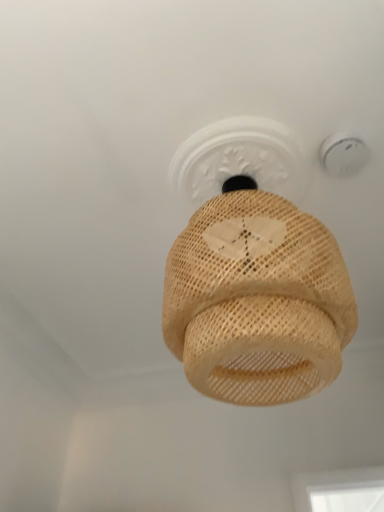
Question: From a real-world perspective, is natural woven lampshade at center under white plastic smoke detector at upper right?

Choices:
 (A) yes
 (B) no

Answer: (A)

Question: Does natural woven lampshade at center have a greater height compared to white plastic smoke detector at upper right?

Choices:
 (A) yes
 (B) no

Answer: (A)

Question: Is there a large distance between natural woven lampshade at center and white plastic smoke detector at upper right?

Choices:
 (A) no
 (B) yes

Answer: (A)

Question: Is natural woven lampshade at center at the right side of white plastic smoke detector at upper right?

Choices:
 (A) no
 (B) yes

Answer: (A)

Question: Can you confirm if natural woven lampshade at center is smaller than white plastic smoke detector at upper right?

Choices:
 (A) no
 (B) yes

Answer: (A)

Question: Is natural woven lampshade at center looking in the opposite direction of white plastic smoke detector at upper right?

Choices:
 (A) no
 (B) yes

Answer: (A)

Question: Considering the relative sizes of white plastic smoke detector at upper right and natural woven lampshade at center in the image provided, is white plastic smoke detector at upper right smaller than natural woven lampshade at center?

Choices:
 (A) no
 (B) yes

Answer: (B)

Question: Would you say white plastic smoke detector at upper right contains natural woven lampshade at center?

Choices:
 (A) no
 (B) yes

Answer: (A)

Question: Could you tell me if white plastic smoke detector at upper right is facing natural woven lampshade at center?

Choices:
 (A) yes
 (B) no

Answer: (B)

Question: From a real-world perspective, is white plastic smoke detector at upper right positioned over natural woven lampshade at center based on gravity?

Choices:
 (A) no
 (B) yes

Answer: (B)

Question: Does white plastic smoke detector at upper right have a lesser width compared to natural woven lampshade at center?

Choices:
 (A) no
 (B) yes

Answer: (B)

Question: Considering the relative sizes of white plastic smoke detector at upper right and natural woven lampshade at center in the image provided, is white plastic smoke detector at upper right taller than natural woven lampshade at center?

Choices:
 (A) yes
 (B) no

Answer: (B)

Question: From a real-world perspective, is white plastic smoke detector at upper right above or below natural woven lampshade at center?

Choices:
 (A) above
 (B) below

Answer: (A)